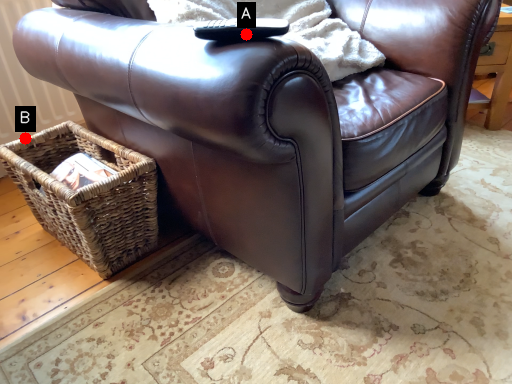
Question: Two points are circled on the image, labeled by A and B beside each circle. Which point appears closest to the camera in this image?

Choices:
 (A) A is closer
 (B) B is closer

Answer: (A)